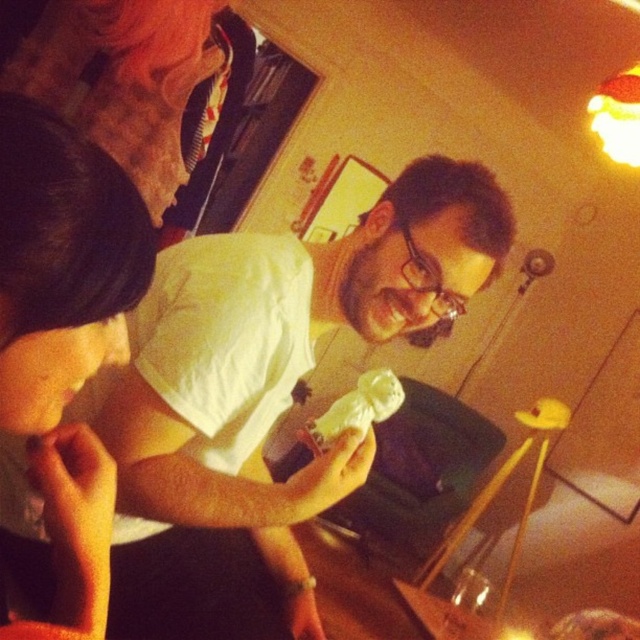
You are standing in the center of the room and want to hand the small object you are holding to the person wearing the matte white shirt at upper left. Based on the coordinates provided, in which general direction should you move to reach them?

The matte white shirt at upper left is located at coordinates point (64, 336). Since you are at the center, you should move towards the upper left direction to reach them.